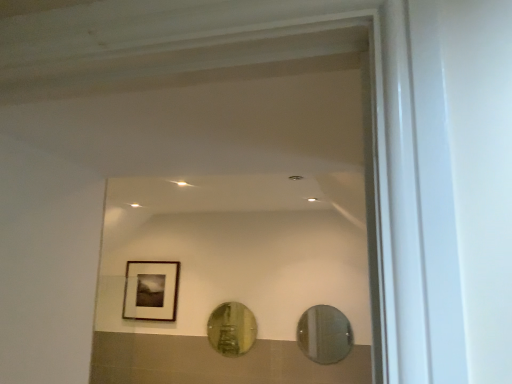
Question: Is clear glass mirror at center, the 2th mirror in the left-to-right sequence, inside the boundaries of gold reflective mirror at center, the second mirror viewed from the right, or outside?

Choices:
 (A) inside
 (B) outside

Answer: (B)

Question: Considering their positions, is clear glass mirror at center, marked as the second mirror in a back-to-front arrangement, located in front of or behind gold reflective mirror at center, the first mirror when ordered from left to right?

Choices:
 (A) behind
 (B) front

Answer: (B)

Question: Which object is the closest to the clear glass mirror at center, the 1th mirror from the right?

Choices:
 (A) gold reflective mirror at center, which is the second mirror from front to back
 (B) matte black frame at upper left

Answer: (A)

Question: Which is farther from the gold reflective mirror at center, the first mirror when ordered from left to right?

Choices:
 (A) matte black frame at upper left
 (B) clear glass mirror at center, the first mirror in the front-to-back sequence

Answer: (A)